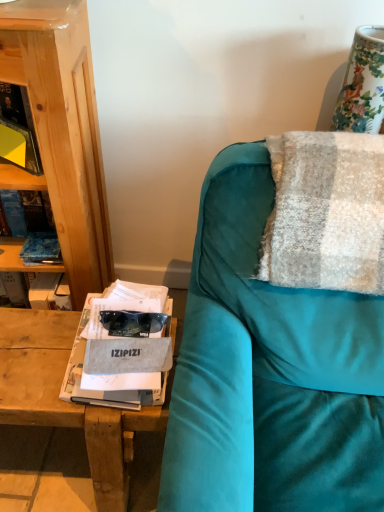
Question: Considering their positions, is gray fabric magazine at left located in front of or behind porcelain floral vase at upper right?

Choices:
 (A) behind
 (B) front

Answer: (B)

Question: Is gray fabric magazine at left to the left or to the right of porcelain floral vase at upper right in the image?

Choices:
 (A) left
 (B) right

Answer: (A)

Question: Which of these objects is positioned farthest from the textured woolen blanket at right?

Choices:
 (A) porcelain floral vase at upper right
 (B) gray fabric magazine at left

Answer: (B)

Question: Estimate the real-world distances between objects in this image. Which object is farther from the gray fabric magazine at left?

Choices:
 (A) porcelain floral vase at upper right
 (B) textured woolen blanket at right

Answer: (A)